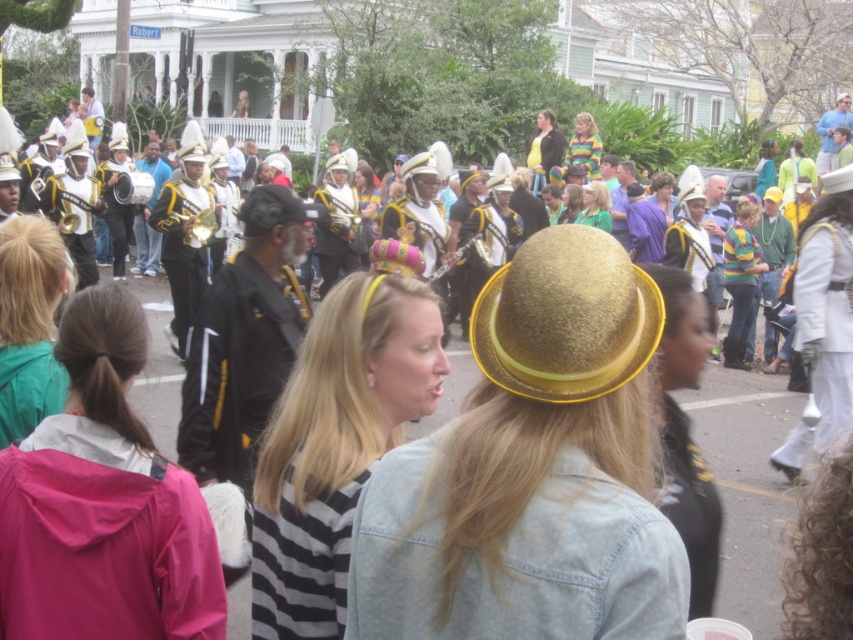
You are a photographer trying to capture the entire scene of the teal fabric jacket at center and the black fabric cap at center in one shot. Which object should you focus on to ensure both are visible without cropping?

Since the teal fabric jacket at center occupies less space than the black fabric cap at center, you should focus on the larger object, the black fabric cap at center, to ensure both are visible in the frame.

You are a photographer trying to capture a photo of the gold textured hat at center and the striped shirt at upper right in the same frame. Based on their sizes in the image, which object would you need to move closer to in order to make them appear the same size?

The gold textured hat at center is smaller than the striped shirt at upper right. To make them appear the same size in the photo, you would need to move closer to the gold textured hat at center.

You are standing at the point marked as point (641, 400) in the image. The marching band is performing on the left side of the frame. Can you see the band members clearly from your current position?

The distance between you and point (641, 400) is 24.15 meters. Since the marching band is on the left side of the frame, you are positioned at that point, so you can see the band members clearly as they are the focus of the foreground individuals.